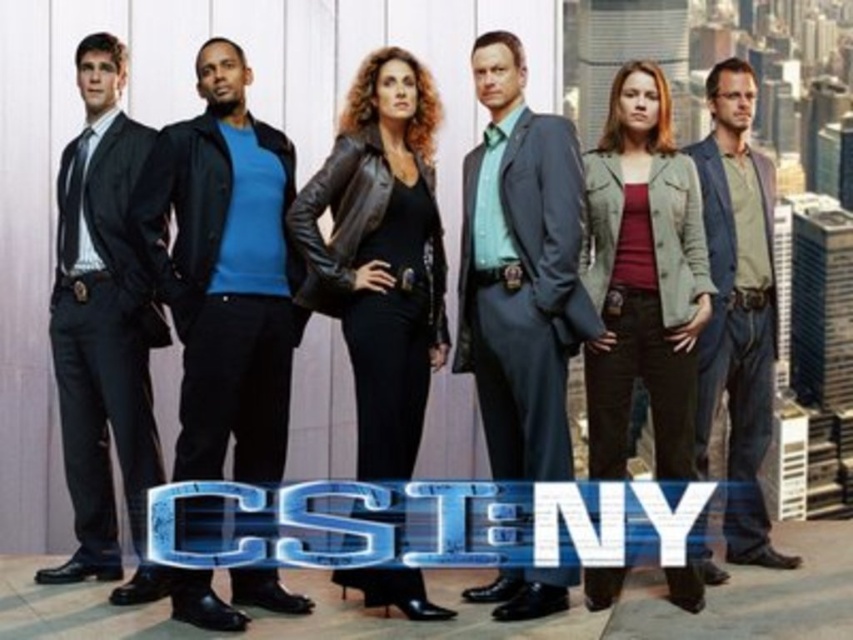
Looking at this image, you are a photographer setting up for a group photo. You notice the matte gray suit at center and the black leather jacket at center. Which one is covering part of the other?

The matte gray suit at center is positioned over the black leather jacket at center, so it is covering part of it.

You are organizing a team photo and need to arrange the individuals so that the black leather jacket at center and the matte black suit at left are side by side. Based on their clothing dimensions, which one should be placed on the right to ensure they fit comfortably within the frame?

The black leather jacket at center has a larger width than the matte black suit at left, so placing the matte black suit at left on the right side would allow for better spacing between them.